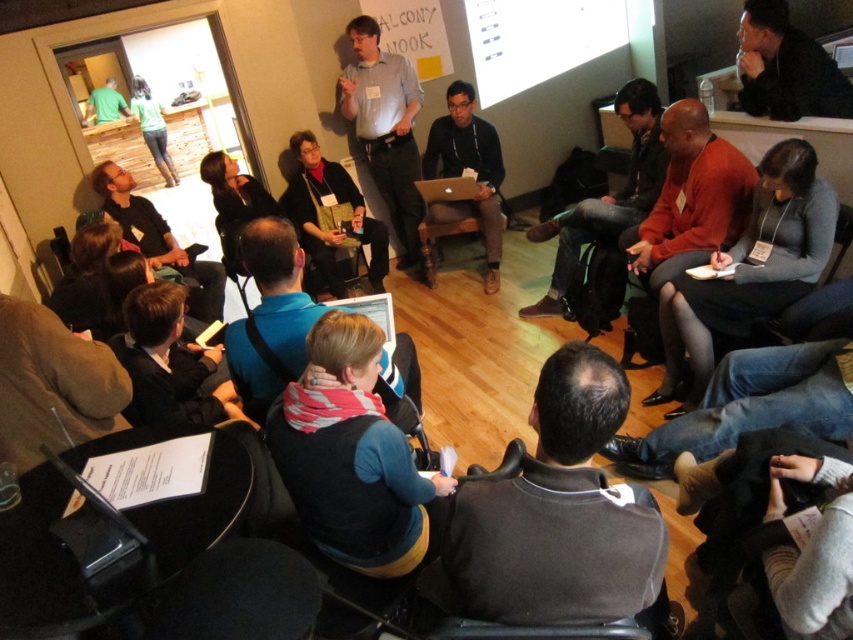
Question: Is light blue shirt at center bigger than matte black laptop at center?

Choices:
 (A) no
 (B) yes

Answer: (B)

Question: Which point appears closest to the camera in this image?

Choices:
 (A) (480, 147)
 (B) (358, 19)
 (C) (601, 490)

Answer: (C)

Question: Which point appears farthest from the camera in this image?

Choices:
 (A) (480, 148)
 (B) (608, 589)

Answer: (A)

Question: Is dark gray sweater at center above light blue shirt at center?

Choices:
 (A) no
 (B) yes

Answer: (A)

Question: Considering the real-world distances, which object is farthest from the matte black laptop at center?

Choices:
 (A) light blue shirt at center
 (B) dark gray sweater at center

Answer: (B)

Question: Does dark gray sweater at center have a smaller size compared to light blue shirt at center?

Choices:
 (A) no
 (B) yes

Answer: (B)